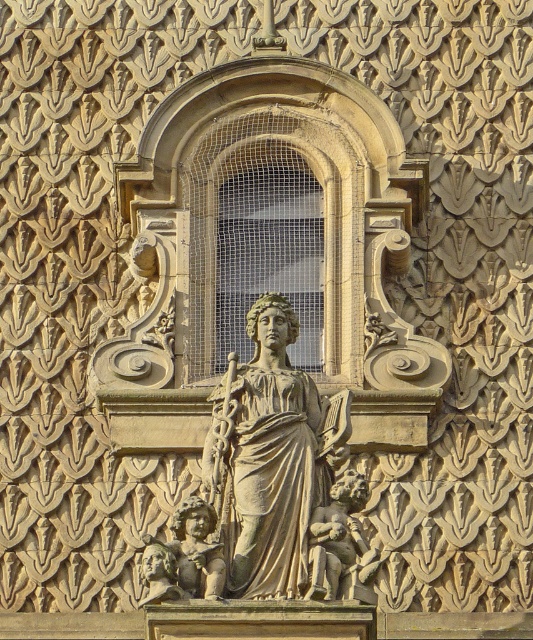
Does beige stone statue at center appear under smooth stone cherub at center?

Actually, beige stone statue at center is above smooth stone cherub at center.

Is point (268, 563) positioned before point (325, 579)?

No, (268, 563) is behind (325, 579).

You are a GUI agent. You are given a task and a screenshot of the screen. Output one action in this format:
    pyautogui.click(x=<x>, y=<y>)
    Task: Click on the beige stone statue at center
    The image size is (533, 640).
    Given the screenshot: What is the action you would take?
    pos(270,458)